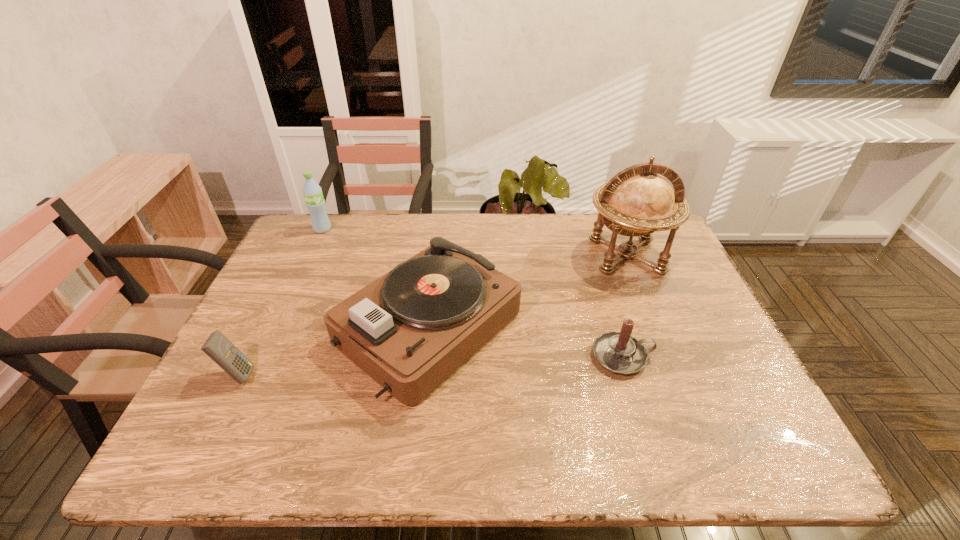
Locate an element on the screen. vacant space that satisfies the following two spatial constraints: 1. on the front-facing side of the tallest object; 2. on the side of the candle with the handle loop is located at coordinates (667, 356).

I want to click on free location that satisfies the following two spatial constraints: 1. on the front-facing side of the globe; 2. on the side of the candle with the handle loop, so click(x=667, y=356).

Where is `free space that satisfies the following two spatial constraints: 1. on the front-facing side of the globe; 2. on the side of the candle with the handle loop`? This screenshot has width=960, height=540. free space that satisfies the following two spatial constraints: 1. on the front-facing side of the globe; 2. on the side of the candle with the handle loop is located at coordinates (667, 356).

Locate an element on the screen. vacant space that satisfies the following two spatial constraints: 1. on the front side of the record player; 2. on the left side of the water bottle is located at coordinates (276, 327).